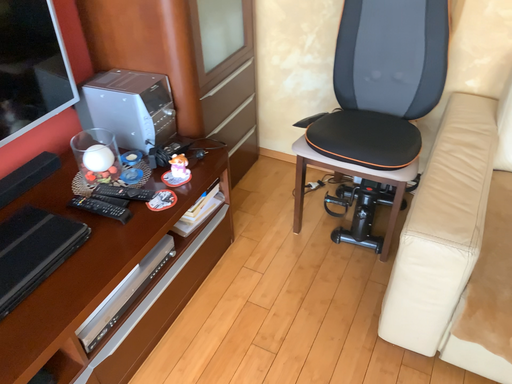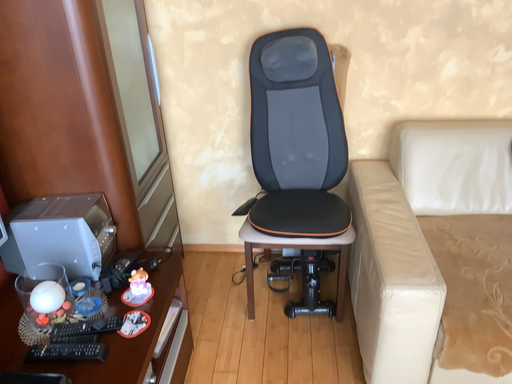
Question: Which way did the camera rotate in the video?

Choices:
 (A) rotated downward
 (B) rotated upward

Answer: (B)